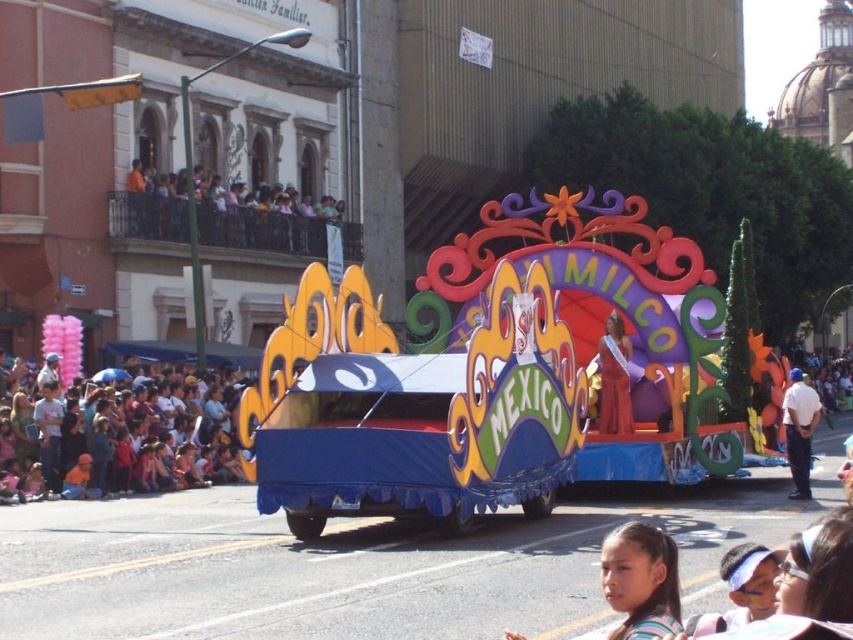
You are a photographer at the parade and want to capture both the matte white children at lower left and the striped fabric headband at lower right in the same frame. Since you can only focus on one subject at a time, which one should you choose to ensure it fills more of your camera viewfinder?

The matte white children at lower left should be chosen because their width is larger than the striped fabric headband at lower right, making them better suited to fill the camera viewfinder.

You are a photographer at the parade and want to capture the float with the person in the foreground. You notice two points marked on your camera screen. Which point, point [636,593] or point [801,385], is closer to you?

Point [636,593] is closer to you because it is in front of point [801,385].